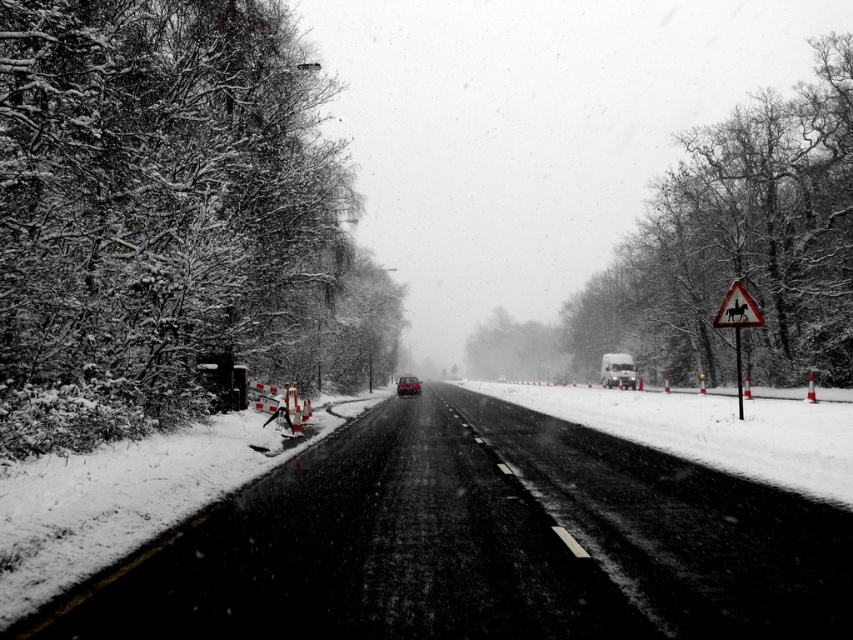
Question: Among these points, which one is farthest from the camera?

Choices:
 (A) (251, 252)
 (B) (496, 422)
 (C) (401, 380)

Answer: (C)

Question: Which point is closer to the camera?

Choices:
 (A) white plastic horse at right
 (B) green matte tree at center

Answer: (A)

Question: Can you confirm if snow-covered branches at left is bigger than green matte tree at center?

Choices:
 (A) no
 (B) yes

Answer: (B)

Question: Which object is farther from the camera taking this photo?

Choices:
 (A) snow-covered tree at right
 (B) black asphalt highway at center
 (C) white powdery snow at road center
 (D) snow-covered branches at left

Answer: (A)

Question: Can you confirm if snow-covered tree at right is smaller than shiny black car at center?

Choices:
 (A) yes
 (B) no

Answer: (B)

Question: Observing the image, what is the correct spatial positioning of white powdery snow at road center in reference to shiny black car at center?

Choices:
 (A) right
 (B) left

Answer: (A)